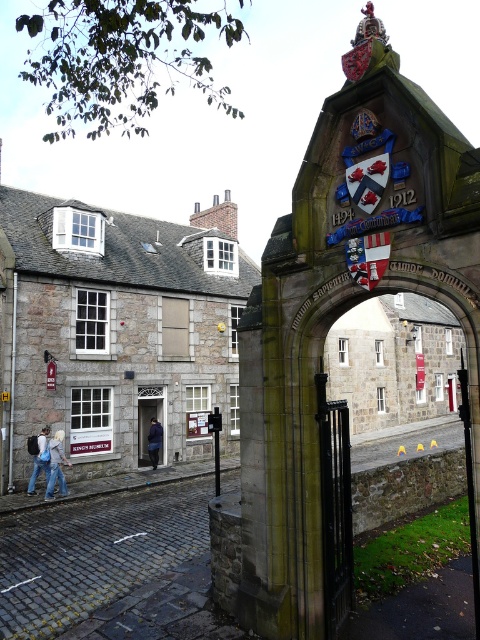
You are standing at point A, which is at coordinates (314, 342). Looking around, you see the stone archway at center. Can you determine if you are standing directly in front of the stone archway at center?

Yes, you are standing directly in front of the stone archway at center because the point you mentioned is exactly where the stone archway at center is located.

You are standing in front of the historic stone archway and notice two items at the lower left corner of the image. Which item is shorter in height between the denim jacket at lower left and the denim jeans at lower left?

The denim jacket at lower left is shorter in height compared to the denim jeans at lower left because it is not as tall as the jeans.

You are standing in front of the historic stone archway leading into the university campus. You notice a point marked at coordinates (314, 342). What does this point represent?

The point at coordinates (314, 342) represents the stone archway at center.